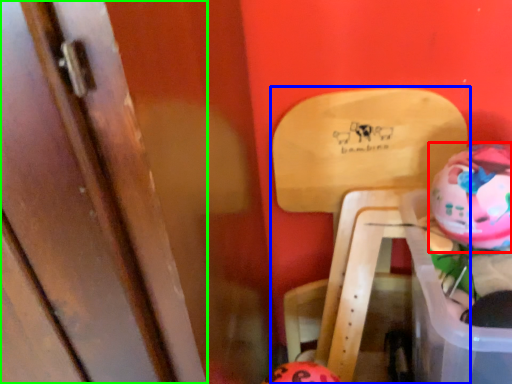
Question: Considering the real-world distances, which object is farthest from piggy bank (highlighted by a red box)? furniture (highlighted by a blue box) or door (highlighted by a green box)?

Choices:
 (A) furniture
 (B) door

Answer: (B)